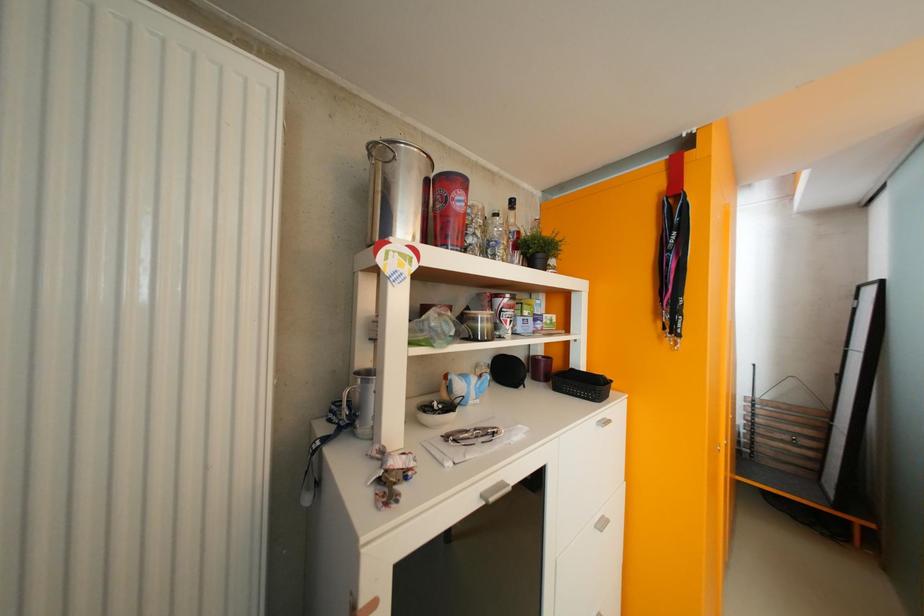
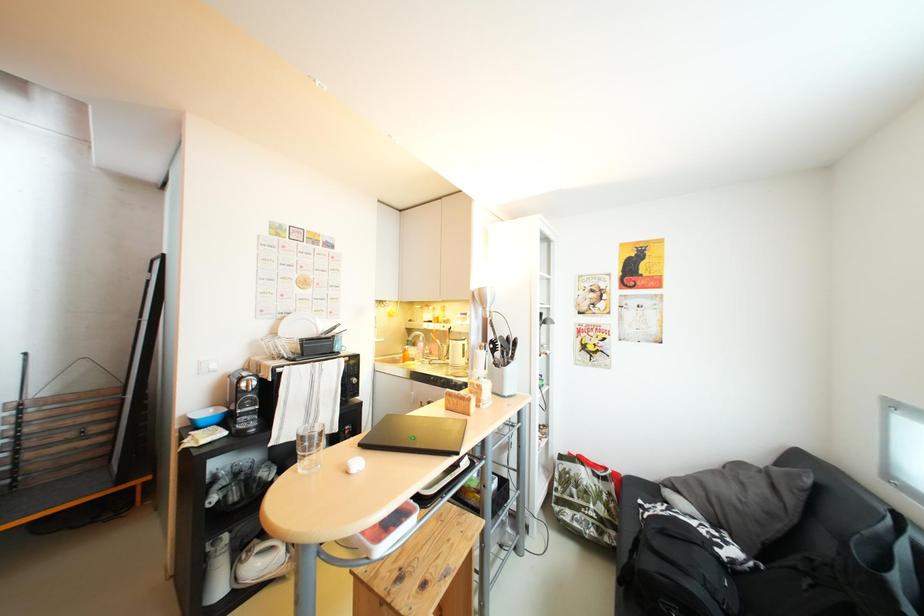
Question: The camera is either moving clockwise (left) or counter-clockwise (right) around the object. The first image is from the beginning of the video and the second image is from the end. Is the camera moving left or right when shooting the video?

Choices:
 (A) Left
 (B) Right

Answer: (A)